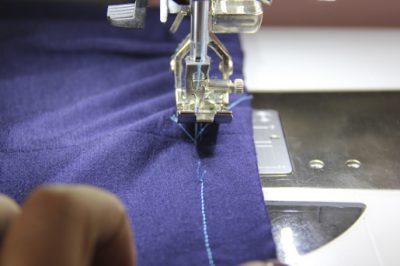
Where is `wall in the background`? wall in the background is located at coordinates (337, 7).